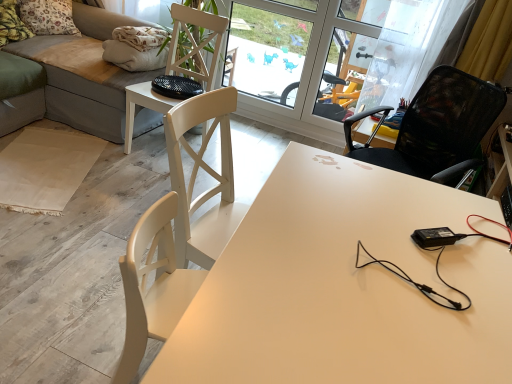
I want to click on vacant region to the left of white wood chair at center, which is the first chair in left-to-right order, so click(93, 145).